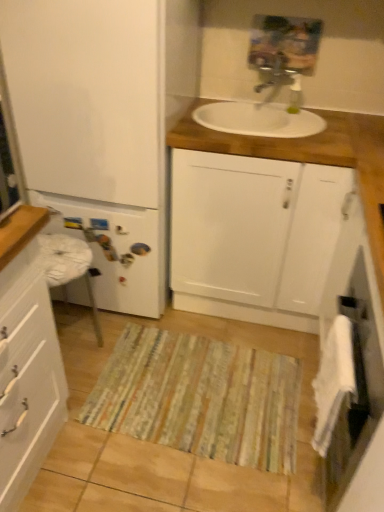
In order to face white matte refrigerator at left, which is the second bathroom cabinet from right to left, should I rotate leftwards or rightwards?

Rotate left and turn 9.995 degrees.

What do you see at coordinates (333, 381) in the screenshot?
I see `white soft towel at lower right` at bounding box center [333, 381].

What are the coordinates of `white glossy cabinet at left, the third bathroom cabinet from the right` in the screenshot? It's located at click(26, 359).

The width and height of the screenshot is (384, 512). Identify the location of white matte cabinet at center, which ranks as the first bathroom cabinet in right-to-left order. (254, 236).

In the scene shown: Measure the distance between point (x=274, y=88) and camera.

The distance of point (x=274, y=88) from camera is 2.01 meters.

Image resolution: width=384 pixels, height=512 pixels. Find the location of `striped fabric doormat at center`. striped fabric doormat at center is located at coordinates coord(200,397).

Which is nearer, (359, 465) or (325, 444)?

Point (359, 465)

Can you confirm if white fabric towel at right is taller than white soft towel at lower right?

Yes, white fabric towel at right is taller than white soft towel at lower right.

Is white fabric towel at right wider or thinner than white soft towel at lower right?

In the image, white fabric towel at right appears to be wider than white soft towel at lower right.

From a real-world perspective, is white fabric towel at right physically below white soft towel at lower right?

Indeed, from a real-world perspective, white fabric towel at right is positioned beneath white soft towel at lower right.

Which of these two, striped fabric doormat at center or white matte refrigerator at left, which is the second bathroom cabinet from right to left, is wider?

Wider between the two is white matte refrigerator at left, which is the second bathroom cabinet from right to left.

The width and height of the screenshot is (384, 512). I want to click on bathroom cabinet that is the 1st object located in front of the striped fabric doormat at center, so click(x=104, y=124).

Does point (206, 426) lie behind point (30, 34)?

Yes, it is.

In the scene shown: Is white matte refrigerator at left, which is the second bathroom cabinet from right to left, completely or partially inside striped fabric doormat at center?

That's incorrect, white matte refrigerator at left, which is the second bathroom cabinet from right to left, is not inside striped fabric doormat at center.

Is white glossy cabinet at left, which is counted as the 1th bathroom cabinet, starting from the left, facing away from white soft towel at lower right?

No.

The image size is (384, 512). In order to click on hand towel behind the white glossy cabinet at left, the third bathroom cabinet from the right in this screenshot , I will do pos(333,381).

From a real-world perspective, relative to white soft towel at lower right, is white glossy cabinet at left, which is counted as the 1th bathroom cabinet, starting from the left, vertically above or below?

In terms of real-world spatial position, white glossy cabinet at left, which is counted as the 1th bathroom cabinet, starting from the left, is below white soft towel at lower right.

Could you tell me if white matte cabinet at center, which ranks as the first bathroom cabinet in right-to-left order, is facing striped fabric doormat at center?

Yes.

Is white matte cabinet at center, which ranks as the first bathroom cabinet in right-to-left order, in contact with striped fabric doormat at center?

No, white matte cabinet at center, which ranks as the first bathroom cabinet in right-to-left order, is not in contact with striped fabric doormat at center.

Considering the sizes of white matte cabinet at center, which ranks as the first bathroom cabinet in right-to-left order, and striped fabric doormat at center in the image, is white matte cabinet at center, which ranks as the first bathroom cabinet in right-to-left order, bigger or smaller than striped fabric doormat at center?

white matte cabinet at center, which ranks as the first bathroom cabinet in right-to-left order, is bigger than striped fabric doormat at center.

Between point (278, 202) and point (105, 374), which one is positioned behind?

The point (105, 374) is farther.

Is white matte cabinet at center, the 3th bathroom cabinet in the left-to-right sequence, not inside white soft towel at lower right?

That's correct, white matte cabinet at center, the 3th bathroom cabinet in the left-to-right sequence, is outside of white soft towel at lower right.

Does white matte cabinet at center, the 3th bathroom cabinet in the left-to-right sequence, have a smaller size compared to white soft towel at lower right?

Actually, white matte cabinet at center, the 3th bathroom cabinet in the left-to-right sequence, might be larger than white soft towel at lower right.

From the image's perspective, between white matte cabinet at center, the 3th bathroom cabinet in the left-to-right sequence, and white soft towel at lower right, which one is located above?

white matte cabinet at center, the 3th bathroom cabinet in the left-to-right sequence, appears higher in the image.

You are a GUI agent. You are given a task and a screenshot of the screen. Output one action in this format:
    pyautogui.click(x=<x>, y=<y>)
    Task: Click on the hand towel on the right side of white matte cabinet at center, the 3th bathroom cabinet in the left-to-right sequence
    
    Given the screenshot: What is the action you would take?
    pyautogui.click(x=333, y=381)

Is white fabric towel at right taller than striped fabric doormat at center?

Yes, white fabric towel at right is taller than striped fabric doormat at center.

Is white fabric towel at right to the left or to the right of striped fabric doormat at center in the image?

From the image, it's evident that white fabric towel at right is to the right of striped fabric doormat at center.

Is white fabric towel at right oriented away from striped fabric doormat at center?

No, striped fabric doormat at center is not at the back of white fabric towel at right.

From a real-world perspective, which object stands above the other?

white fabric towel at right is physically above.

Based on their positions, is white soft towel at lower right located to the left or right of white matte refrigerator at left, which is the 2th bathroom cabinet in left-to-right order?

Clearly, white soft towel at lower right is on the right of white matte refrigerator at left, which is the 2th bathroom cabinet in left-to-right order, in the image.

From a real-world perspective, which object stands above the other?

From a 3D spatial view, white matte refrigerator at left, which is the 2th bathroom cabinet in left-to-right order, is above.

From the image's perspective, is white soft towel at lower right above white matte refrigerator at left, which is the 2th bathroom cabinet in left-to-right order?

Actually, white soft towel at lower right appears below white matte refrigerator at left, which is the 2th bathroom cabinet in left-to-right order, in the image.

Identify the location of the 2nd bathroom cabinet to the left when counting from the white soft towel at lower right. The image size is (384, 512). (104, 124).

Where is `hand towel behind the white fabric towel at right`? hand towel behind the white fabric towel at right is located at coordinates (333, 381).

In the image, there is a white matte refrigerator at left, which is the 2th bathroom cabinet in left-to-right order. Where is `doormat below it (from the image's perspective)`? This screenshot has width=384, height=512. doormat below it (from the image's perspective) is located at coordinates (200, 397).

From the image, which object appears to be nearer to white matte cabinet at center, which ranks as the first bathroom cabinet in right-to-left order, white fabric towel at right or striped fabric doormat at center?

white fabric towel at right is closer to white matte cabinet at center, which ranks as the first bathroom cabinet in right-to-left order.

Based on their spatial positions, is white matte refrigerator at left, which is the second bathroom cabinet from right to left, or white fabric towel at right further from white soft towel at lower right?

The object further to white soft towel at lower right is white matte refrigerator at left, which is the second bathroom cabinet from right to left.

When comparing their distances from white glossy cabinet at left, which is counted as the 1th bathroom cabinet, starting from the left, does striped fabric doormat at center or white soft towel at lower right seem closer?

Among the two, striped fabric doormat at center is located nearer to white glossy cabinet at left, which is counted as the 1th bathroom cabinet, starting from the left.

Considering their positions, is striped fabric doormat at center positioned closer to white matte cabinet at center, the 3th bathroom cabinet in the left-to-right sequence, than white soft towel at lower right?

striped fabric doormat at center is closer to white matte cabinet at center, the 3th bathroom cabinet in the left-to-right sequence.

Which object lies nearer to the anchor point striped fabric doormat at center, white soft towel at lower right or white fabric towel at right?

white soft towel at lower right is positioned closer to the anchor striped fabric doormat at center.

Estimate the real-world distances between objects in this image. Which object is further from white soft towel at lower right, white fabric towel at right or metallic silver faucet at upper center?

metallic silver faucet at upper center is further to white soft towel at lower right.

Looking at the image, which one is located closer to white soft towel at lower right, white matte refrigerator at left, which is the 2th bathroom cabinet in left-to-right order, or metallic silver faucet at upper center?

white matte refrigerator at left, which is the 2th bathroom cabinet in left-to-right order, lies closer to white soft towel at lower right than the other object.

From the picture: Based on their spatial positions, is white matte cabinet at center, the 3th bathroom cabinet in the left-to-right sequence, or white soft towel at lower right closer to white fabric towel at right?

white soft towel at lower right is positioned closer to the anchor white fabric towel at right.

Identify the location of hand towel positioned between white fabric towel at right and striped fabric doormat at center from near to far. (333, 381).

Where is `bathroom cabinet between white matte refrigerator at left, which is the 2th bathroom cabinet in left-to-right order, and metallic silver faucet at upper center`? bathroom cabinet between white matte refrigerator at left, which is the 2th bathroom cabinet in left-to-right order, and metallic silver faucet at upper center is located at coordinates point(254,236).

Where is `screen door between metallic silver faucet at upper center and striped fabric doormat at center vertically`? screen door between metallic silver faucet at upper center and striped fabric doormat at center vertically is located at coordinates (356, 389).

Where is `hand towel between white glossy cabinet at left, the third bathroom cabinet from the right, and white fabric towel at right`? Image resolution: width=384 pixels, height=512 pixels. hand towel between white glossy cabinet at left, the third bathroom cabinet from the right, and white fabric towel at right is located at coordinates (333, 381).